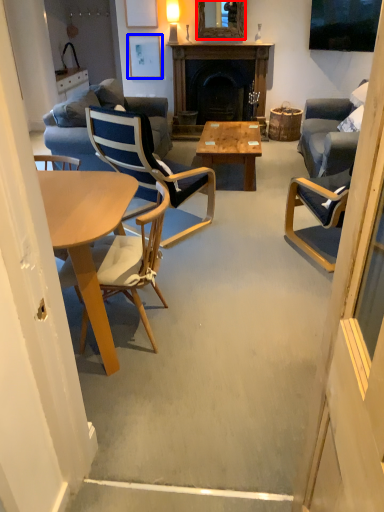
Question: Which object appears farthest to the camera in this image, mirror (highlighted by a red box) or picture frame (highlighted by a blue box)?

Choices:
 (A) mirror
 (B) picture frame

Answer: (B)